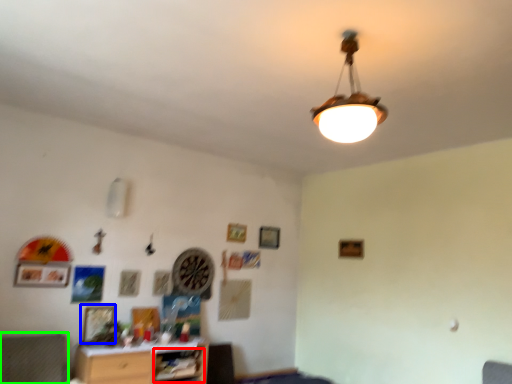
Question: Based on their relative distances, which object is farther from shelf (highlighted by a red box)? Choose from picture frame (highlighted by a blue box) and swivel chair (highlighted by a green box).

Choices:
 (A) picture frame
 (B) swivel chair

Answer: (B)